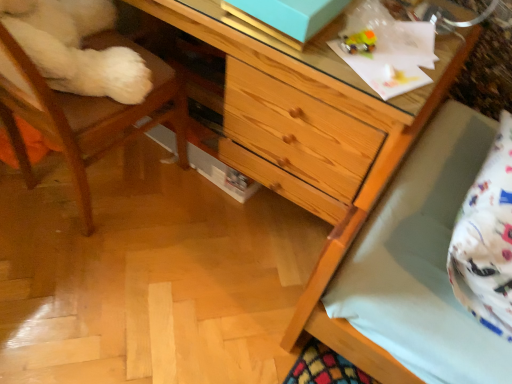
Image resolution: width=512 pixels, height=384 pixels. I want to click on unoccupied area in front of translucent plastic toy at upper right, so click(x=365, y=79).